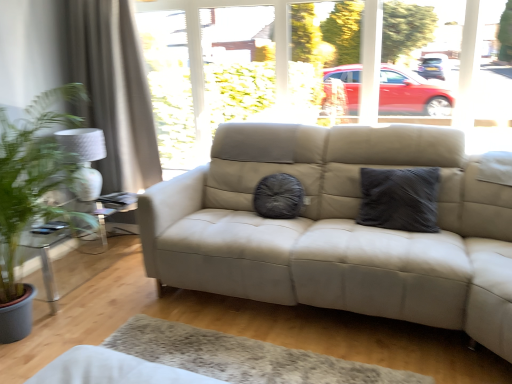
Question: Relative to white textured curtain at left, is clear glass table at left in front or behind?

Choices:
 (A) front
 (B) behind

Answer: (A)

Question: Considering the positions of clear glass table at left and white textured curtain at left in the image, is clear glass table at left wider or thinner than white textured curtain at left?

Choices:
 (A) wide
 (B) thin

Answer: (A)

Question: Which object is the closest to the transparent glass window at center?

Choices:
 (A) white textured curtain at left
 (B) clear glass table at left
 (C) dark grey textured pillow at center

Answer: (A)

Question: Based on their relative distances, which object is farther from the transparent glass window at center?

Choices:
 (A) dark grey textured pillow at center
 (B) clear glass table at left
 (C) white textured curtain at left

Answer: (B)